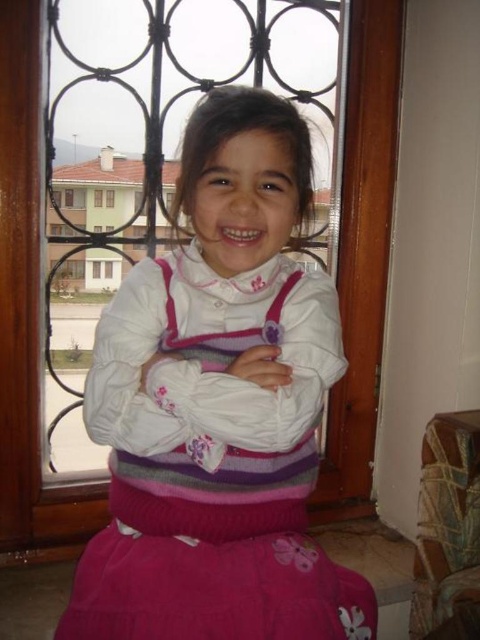
You are a fashion designer observing the image. You need to determine if the pink knitted sweater at center and the white matte arm at center can be photographed together in a single closeup shot without any part being cut off. The camera has a focal length that allows capturing objects within 5 centimeters of each other in the frame. Can they be captured together?

The distance between the pink knitted sweater at center and the white matte arm at center is 5.10 centimeters. Since the camera can capture objects within 5 centimeters, the 5.10 cm distance exceeds this limit, so they cannot be photographed together in a single closeup without cropping.

What are the coordinates of the pink knitted sweater at center?

The pink knitted sweater at center is located at coordinates point (218, 406).